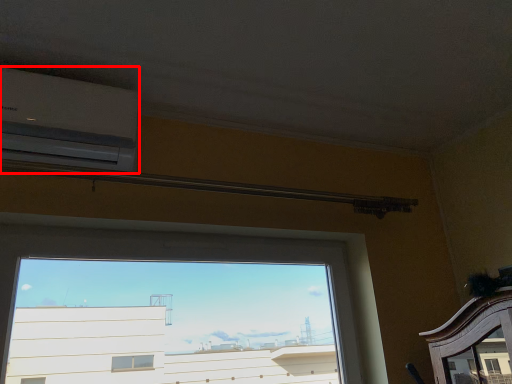
Question: From the image's perspective, where is air conditioning (annotated by the red box) located relative to window?

Choices:
 (A) above
 (B) below

Answer: (A)